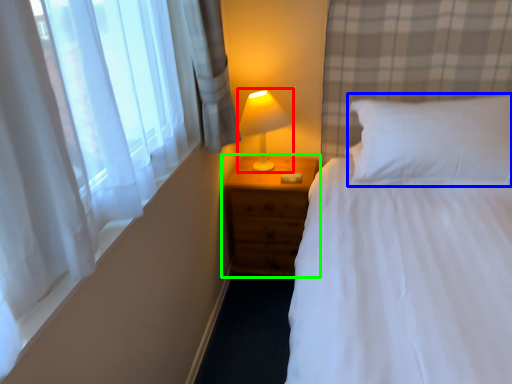
Question: Considering the real-world distances, which object is farthest from lamp (highlighted by a red box)? pillow (highlighted by a blue box) or nightstand (highlighted by a green box)?

Choices:
 (A) pillow
 (B) nightstand

Answer: (A)